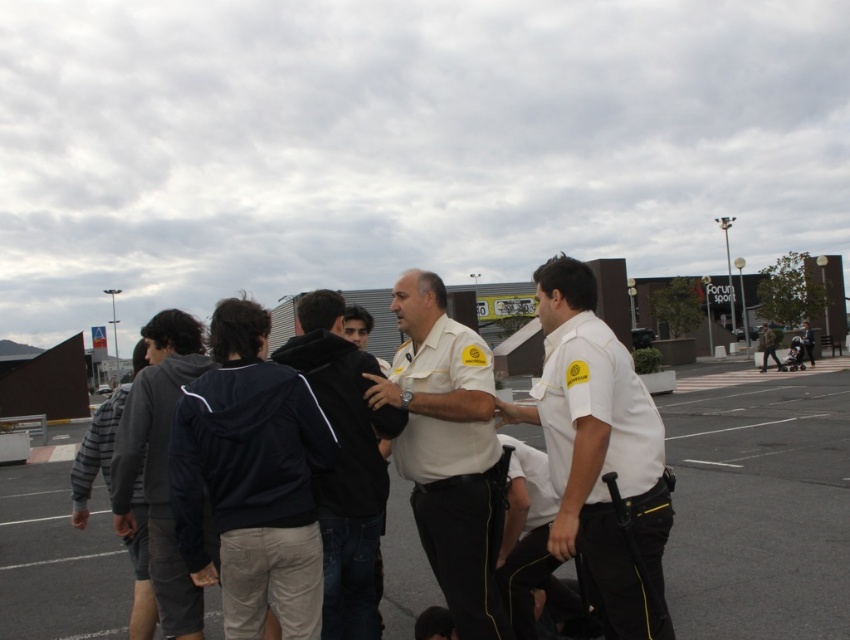
Question: Which object appears closest to the camera in this image?

Choices:
 (A) camouflage fabric jacket at center
 (B) dark gray hoodie at left
 (C) white uniform shirt at center

Answer: (C)

Question: Considering the real-world distances, which object is closest to the black uniform pants at center?

Choices:
 (A) dark gray hoodie at left
 (B) camouflage fabric jacket at center
 (C) white uniform at center

Answer: (C)

Question: Which of the following is the closest to the observer?

Choices:
 (A) camouflage fabric jacket at center
 (B) dark gray hoodie at left
 (C) striped cotton sweater at left
 (D) white uniform at center

Answer: (B)

Question: Does white uniform shirt at center lie in front of white uniform at center?

Choices:
 (A) yes
 (B) no

Answer: (A)

Question: Does white uniform at center have a lesser width compared to striped cotton sweater at left?

Choices:
 (A) no
 (B) yes

Answer: (B)

Question: Does dark blue jacket at center appear on the left side of striped cotton sweater at left?

Choices:
 (A) no
 (B) yes

Answer: (A)